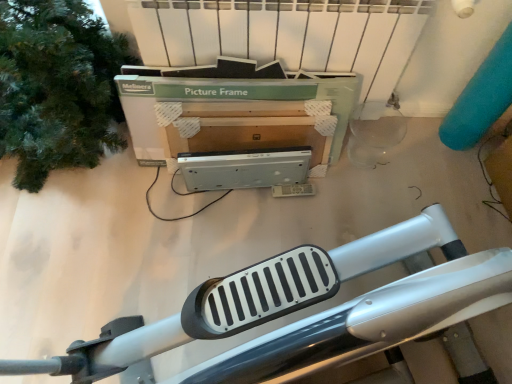
Locate an element on the screen. Image resolution: width=512 pixels, height=384 pixels. blank space above silver metallic exercise machine at lower center (from a real-world perspective) is located at coordinates (240, 224).